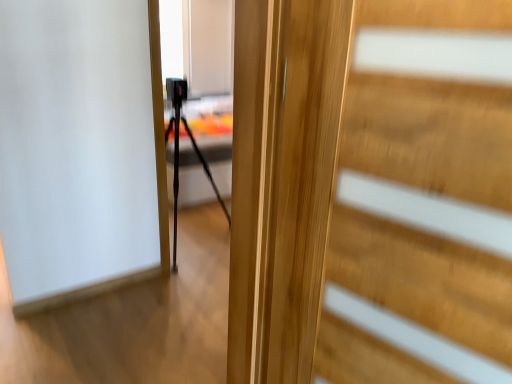
Question: Considering their positions, is black matte tripod at center located in front of or behind wooden door at center?

Choices:
 (A) front
 (B) behind

Answer: (B)

Question: Is black matte tripod at center wider or thinner than wooden door at center?

Choices:
 (A) wide
 (B) thin

Answer: (A)

Question: Considering the positions of black matte tripod at center and wooden door at center in the image, is black matte tripod at center taller or shorter than wooden door at center?

Choices:
 (A) short
 (B) tall

Answer: (B)

Question: Considering the positions of wooden door at center and black matte tripod at center in the image, is wooden door at center bigger or smaller than black matte tripod at center?

Choices:
 (A) small
 (B) big

Answer: (A)

Question: From a real-world perspective, is wooden door at center above or below black matte tripod at center?

Choices:
 (A) above
 (B) below

Answer: (A)

Question: Is wooden door at center taller or shorter than black matte tripod at center?

Choices:
 (A) tall
 (B) short

Answer: (B)

Question: Is point (249, 347) closer or farther from the camera than point (176, 183)?

Choices:
 (A) farther
 (B) closer

Answer: (B)